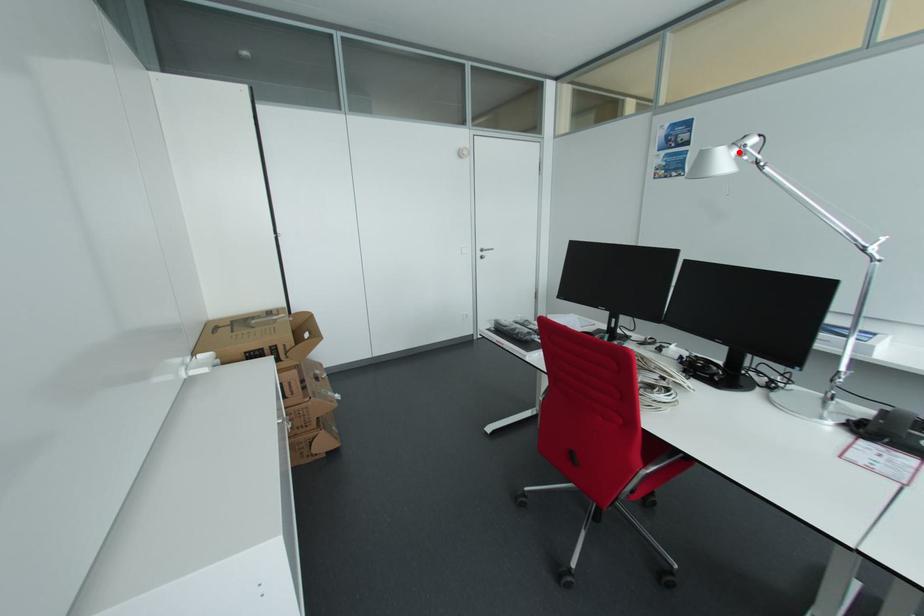
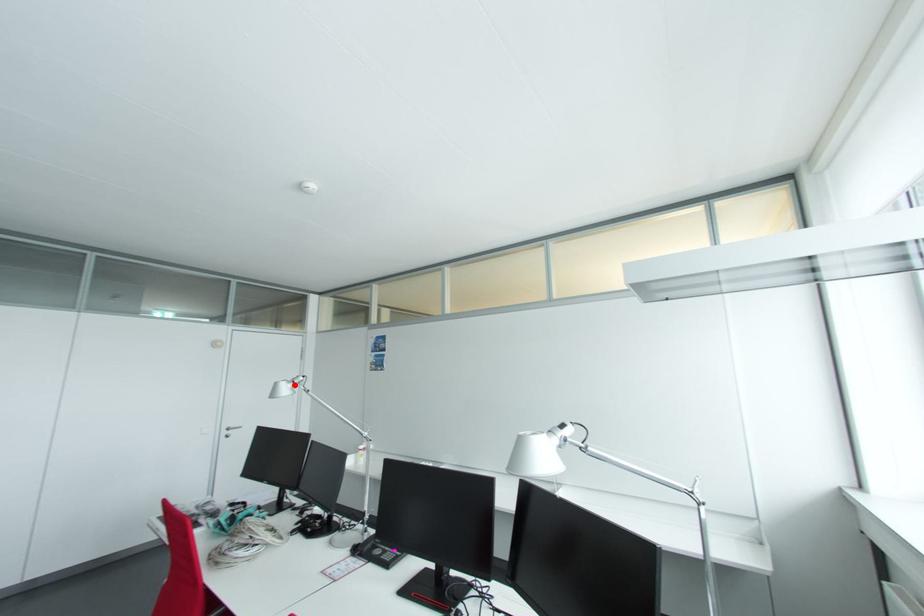
I am providing you with two images of the same scene from different viewpoints. A red point is marked on the first image and another point is marked on the second image. Are the points marked in image1 and image2 representing the same 3D position?

Yes